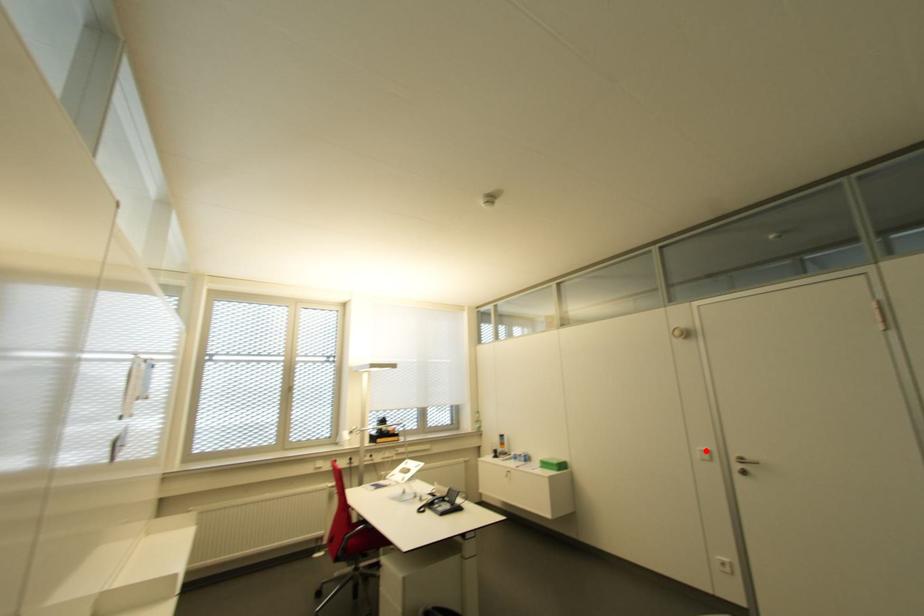
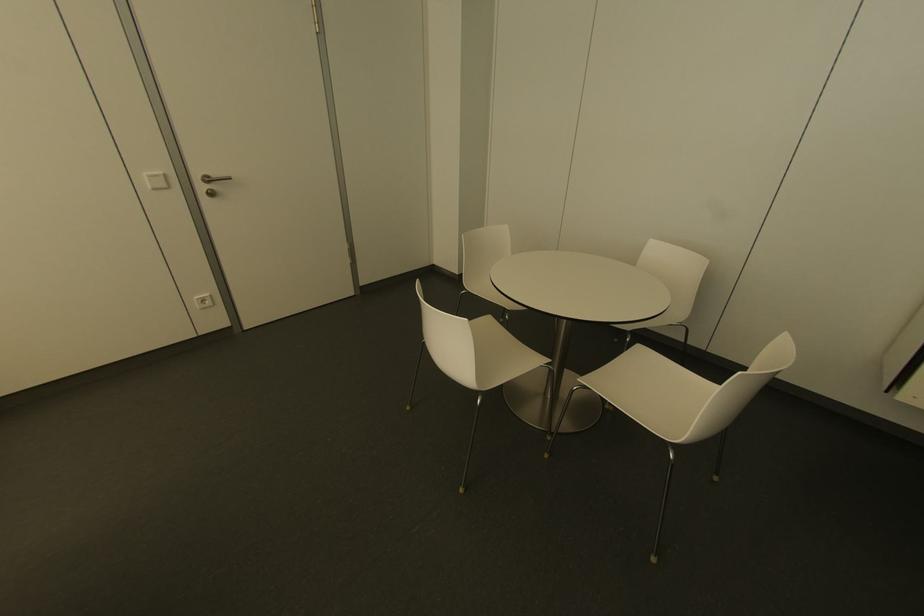
Locate, in the second image, the point that corresponds to the highlighted location in the first image.

(159, 172)